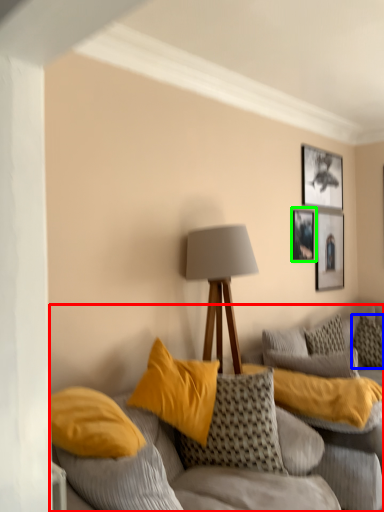
Question: Considering the real-world distances, which object is farthest from studio couch (highlighted by a red box)? pillow (highlighted by a blue box) or picture frame (highlighted by a green box)?

Choices:
 (A) pillow
 (B) picture frame

Answer: (B)